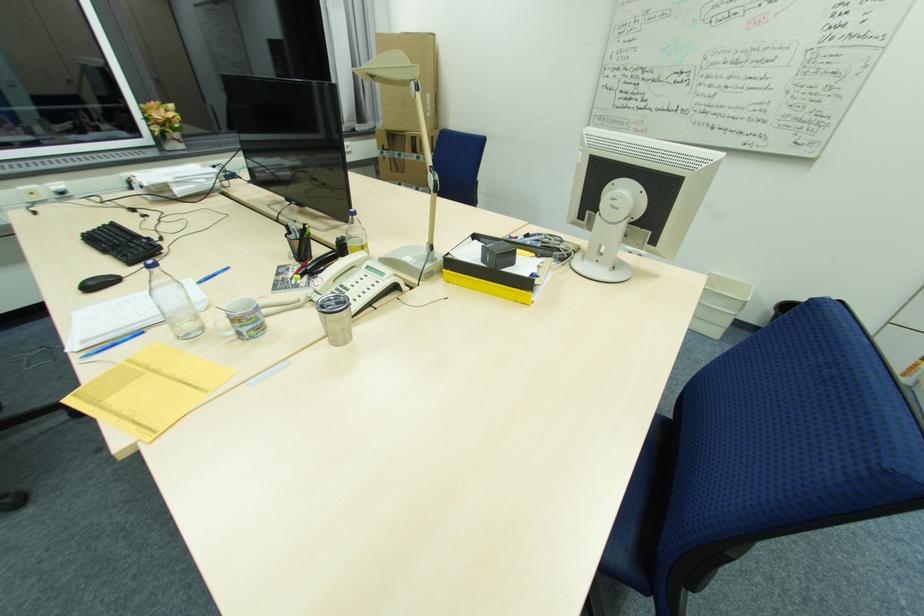
Image resolution: width=924 pixels, height=616 pixels. What are the coordinates of `telephone handset` in the screenshot? It's located at (321, 261).